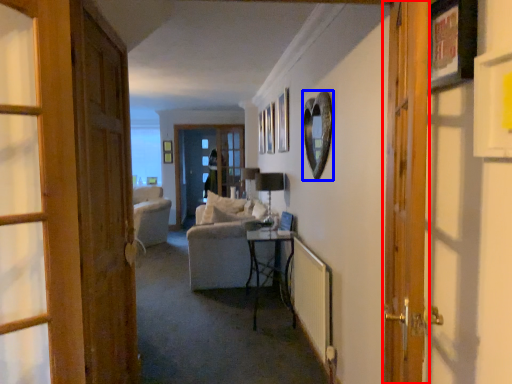
Question: Which of the following is the closest to the observer, door (highlighted by a red box) or picture frame (highlighted by a blue box)?

Choices:
 (A) door
 (B) picture frame

Answer: (A)